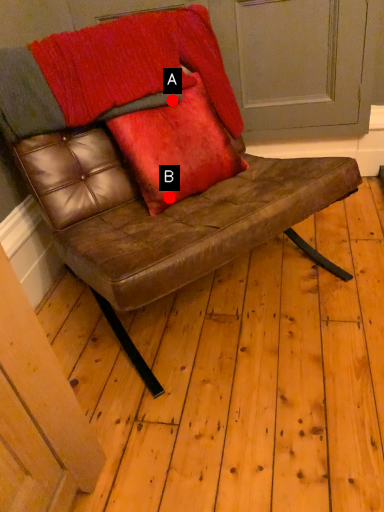
Question: Two points are circled on the image, labeled by A and B beside each circle. Which point appears farthest from the camera in this image?

Choices:
 (A) A is further
 (B) B is further

Answer: (A)